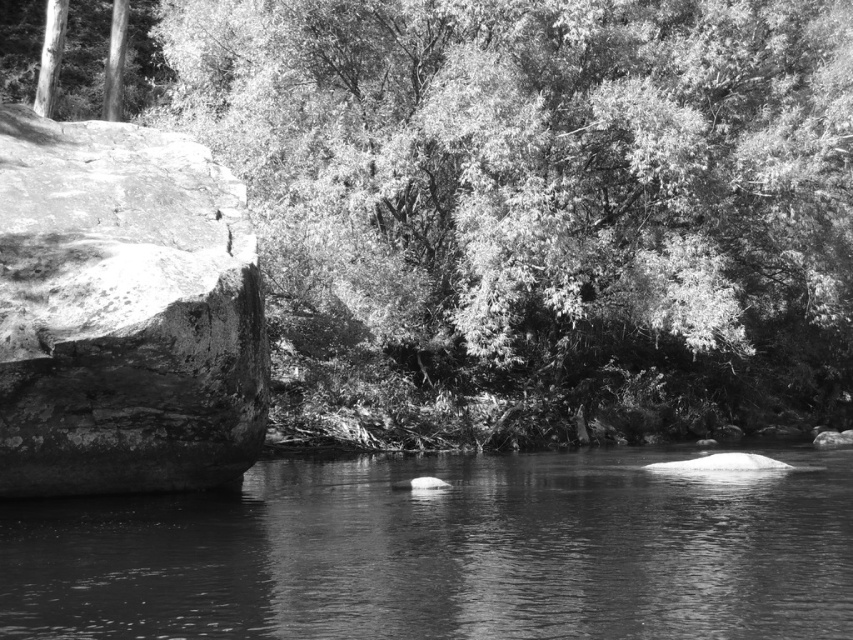
Question: Among these points, which one is nearest to the camera?

Choices:
 (A) (675, 374)
 (B) (125, 163)

Answer: (B)

Question: Is smooth green leaves at upper center positioned behind rough textured rock at left?

Choices:
 (A) yes
 (B) no

Answer: (A)

Question: Is smooth green leaves at upper center positioned at the back of smooth water at center?

Choices:
 (A) yes
 (B) no

Answer: (A)

Question: Which point is closer to the camera?

Choices:
 (A) (585, 76)
 (B) (138, 392)
 (C) (45, 580)

Answer: (C)

Question: Is smooth water at center to the right of rough textured rock at left from the viewer's perspective?

Choices:
 (A) yes
 (B) no

Answer: (A)

Question: Among these points, which one is nearest to the camera?

Choices:
 (A) (6, 161)
 (B) (674, 540)
 (C) (734, 268)

Answer: (B)